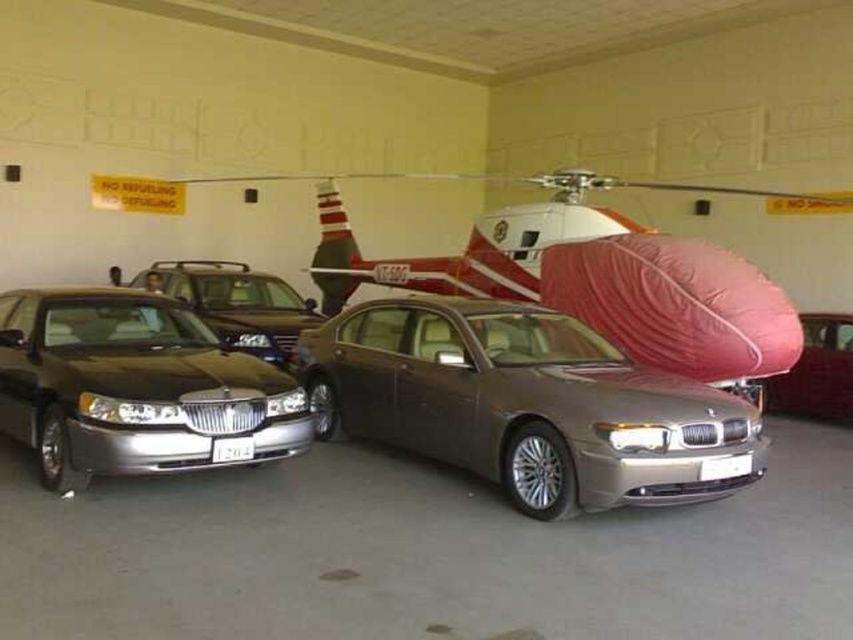
You are a parking attendant who needs to fit both the satin black sedan at left and the shiny silver sedan at center into a narrow parking space that can only accommodate a vehicle up to 1.8 meters in width. Based on the scene, which car might not fit and why?

The satin black sedan at left has a greater width than the shiny silver sedan at center. Since the parking space can only accommodate up to 1.8 meters, the satin black sedan at left might not fit due to its wider dimensions.